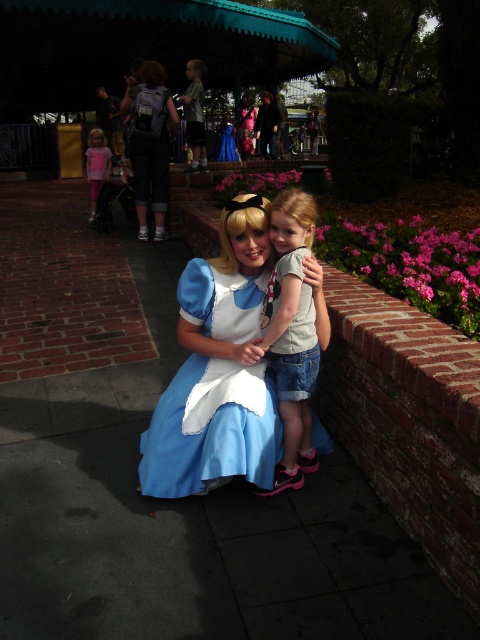
Is denim shorts at center smaller than pink cotton shirt at left?

Indeed, denim shorts at center has a smaller size compared to pink cotton shirt at left.

How much distance is there between denim shorts at center and pink cotton shirt at left?

denim shorts at center is 5.90 meters from pink cotton shirt at left.

Is point (312, 212) positioned after point (92, 152)?

No, it is in front of (92, 152).

You are a GUI agent. You are given a task and a screenshot of the screen. Output one action in this format:
    pyautogui.click(x=<x>, y=<y>)
    Task: Click on the denim shorts at center
    Image resolution: width=480 pixels, height=640 pixels.
    Given the screenshot: What is the action you would take?
    pyautogui.click(x=291, y=333)

Who is more forward, (299,259) or (152,77)?

Point (299,259)

Between denim shorts at center and matte black backpack at upper center, which one is positioned lower?

denim shorts at center

Does point (276, 323) lie behind point (139, 152)?

No, it is in front of (139, 152).

Image resolution: width=480 pixels, height=640 pixels. Identify the location of denim shorts at center. pyautogui.click(x=291, y=333).

Is blue satin dress at center to the right of pink cotton shirt at left from the viewer's perspective?

Yes, blue satin dress at center is to the right of pink cotton shirt at left.

Can you confirm if blue satin dress at center is bigger than pink cotton shirt at left?

No.

The image size is (480, 640). Find the location of `blue satin dress at center`. blue satin dress at center is located at coordinates [x=212, y=428].